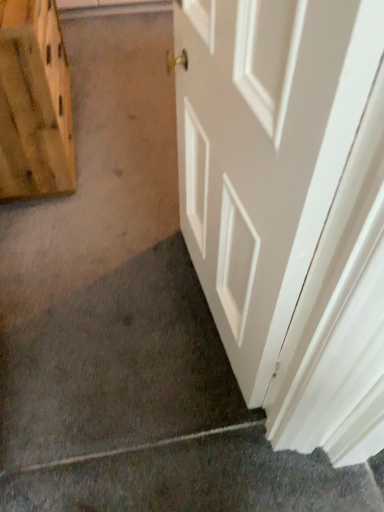
Question: From their relative heights in the image, would you say white glossy door at center is taller or shorter than wooden plank at left?

Choices:
 (A) short
 (B) tall

Answer: (B)

Question: Is white glossy door at center spatially inside wooden plank at left, or outside of it?

Choices:
 (A) outside
 (B) inside

Answer: (A)

Question: Estimate the real-world distances between objects in this image. Which object is farther from the white glossy door at center?

Choices:
 (A) wooden plank at left
 (B) gray matte concrete at lower left

Answer: (A)

Question: Which of these objects is positioned closest to the gray matte concrete at lower left?

Choices:
 (A) white glossy door at center
 (B) wooden plank at left

Answer: (A)